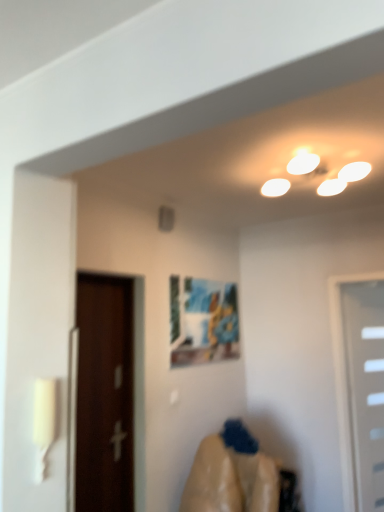
Question: Considering the relative sizes of matte plastic picture frame at center and smooth beige fabric at lower center in the image provided, is matte plastic picture frame at center thinner than smooth beige fabric at lower center?

Choices:
 (A) no
 (B) yes

Answer: (B)

Question: From the image's perspective, is matte plastic picture frame at center beneath smooth beige fabric at lower center?

Choices:
 (A) yes
 (B) no

Answer: (B)

Question: Is matte plastic picture frame at center not inside smooth beige fabric at lower center?

Choices:
 (A) no
 (B) yes

Answer: (B)

Question: Is matte plastic picture frame at center shorter than smooth beige fabric at lower center?

Choices:
 (A) no
 (B) yes

Answer: (B)

Question: Is matte plastic picture frame at center smaller than smooth beige fabric at lower center?

Choices:
 (A) yes
 (B) no

Answer: (A)

Question: Can you confirm if matte plastic picture frame at center is wider than smooth beige fabric at lower center?

Choices:
 (A) yes
 (B) no

Answer: (B)

Question: Can you confirm if brown wooden door at left, the 2th door in the right-to-left sequence, is positioned to the right of matte plastic picture frame at center?

Choices:
 (A) yes
 (B) no

Answer: (B)

Question: Does brown wooden door at left, the second door from the back, turn towards matte plastic picture frame at center?

Choices:
 (A) yes
 (B) no

Answer: (B)

Question: Can matte plastic picture frame at center be found inside brown wooden door at left, the second door from the back?

Choices:
 (A) no
 (B) yes

Answer: (A)

Question: Can you confirm if brown wooden door at left, the second door from the back, is taller than matte plastic picture frame at center?

Choices:
 (A) no
 (B) yes

Answer: (B)

Question: From a real-world perspective, is brown wooden door at left, positioned as the first door in front-to-back order, over matte plastic picture frame at center?

Choices:
 (A) no
 (B) yes

Answer: (A)

Question: Can you confirm if brown wooden door at left, the second door from the back, is wider than matte plastic picture frame at center?

Choices:
 (A) yes
 (B) no

Answer: (A)

Question: Can you confirm if matte plastic picture frame at center is taller than white plastic door at right, the 1th door in the back-to-front sequence?

Choices:
 (A) yes
 (B) no

Answer: (B)